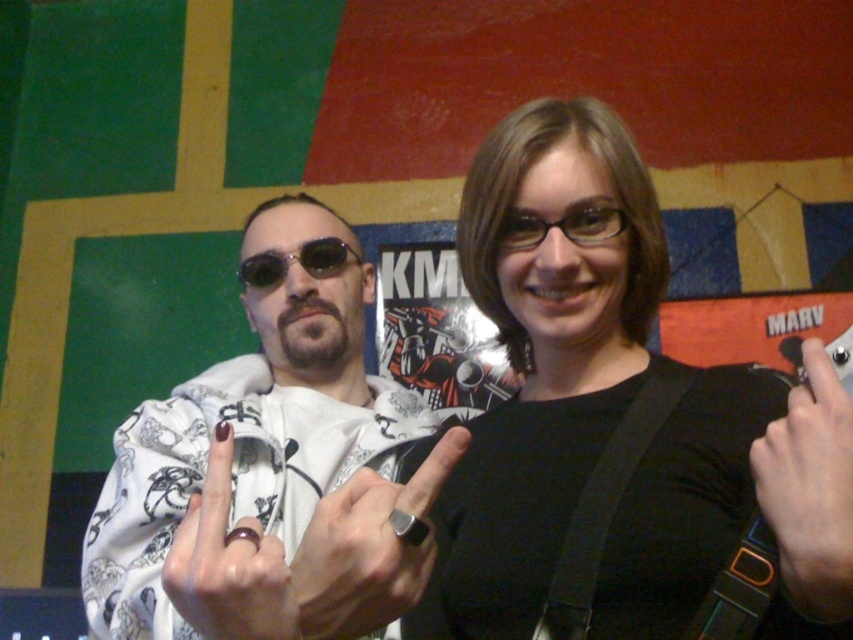
Question: Which object is the farthest from the silver metallic ring at center?

Choices:
 (A) dark matte ring at middle
 (B) black matte shirt at center
 (C) black leather hand at center

Answer: (B)

Question: Is white printed hoodie at center positioned behind silver metallic ring at center?

Choices:
 (A) no
 (B) yes

Answer: (A)

Question: Among these points, which one is nearest to the camera?

Choices:
 (A) (302, 604)
 (B) (218, 563)
 (C) (480, 257)

Answer: (B)

Question: Considering the real-world distances, which object is closest to the black matte shirt at center?

Choices:
 (A) white printed hoodie at center
 (B) dark matte ring at middle
 (C) sunglasses at center
 (D) black leather hand at center

Answer: (D)

Question: Is white printed hoodie at center to the right of dark matte ring at middle from the viewer's perspective?

Choices:
 (A) no
 (B) yes

Answer: (A)

Question: Does black matte shirt at center have a lesser width compared to sunglasses at center?

Choices:
 (A) no
 (B) yes

Answer: (A)